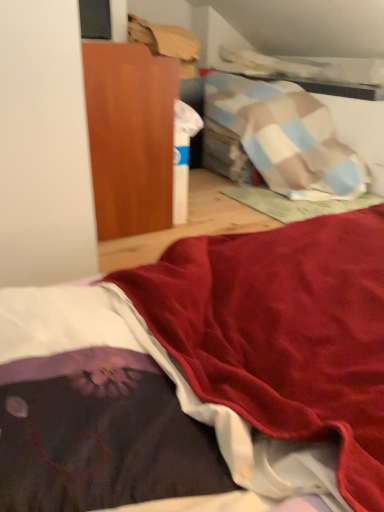
Question: Relative to wooden cabinet at upper left, is velvet dark purple blanket at lower left in front or behind?

Choices:
 (A) front
 (B) behind

Answer: (A)

Question: From the image's perspective, is velvet dark purple blanket at lower left positioned above or below wooden cabinet at upper left?

Choices:
 (A) above
 (B) below

Answer: (B)

Question: Is velvet dark purple blanket at lower left to the left or to the right of wooden cabinet at upper left in the image?

Choices:
 (A) left
 (B) right

Answer: (B)

Question: Does point (130, 151) appear closer or farther from the camera than point (39, 480)?

Choices:
 (A) closer
 (B) farther

Answer: (B)

Question: In terms of size, does wooden cabinet at upper left appear bigger or smaller than velvet dark purple blanket at lower left?

Choices:
 (A) small
 (B) big

Answer: (B)

Question: From their relative heights in the image, would you say wooden cabinet at upper left is taller or shorter than velvet dark purple blanket at lower left?

Choices:
 (A) short
 (B) tall

Answer: (B)

Question: From the image's perspective, is wooden cabinet at upper left located above or below velvet dark purple blanket at lower left?

Choices:
 (A) above
 (B) below

Answer: (A)